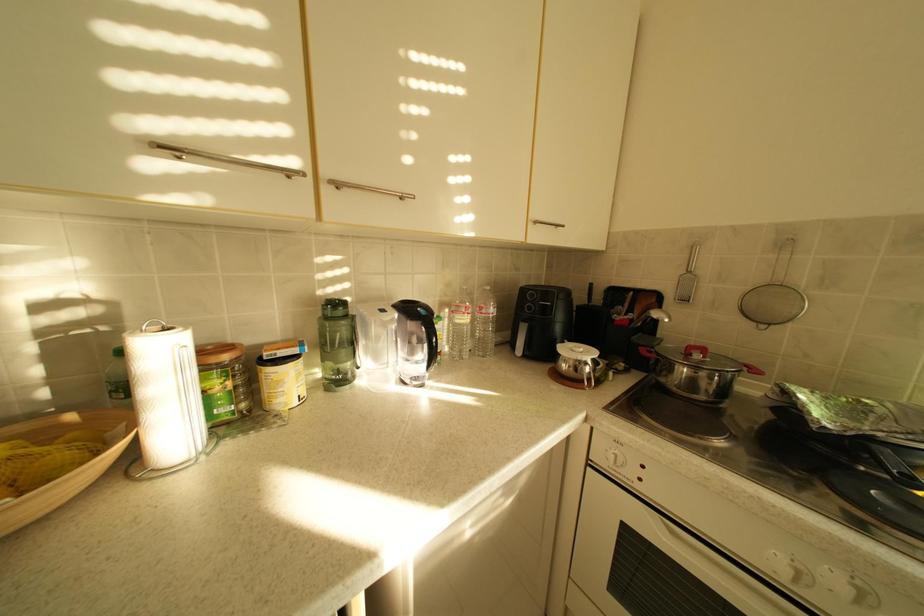
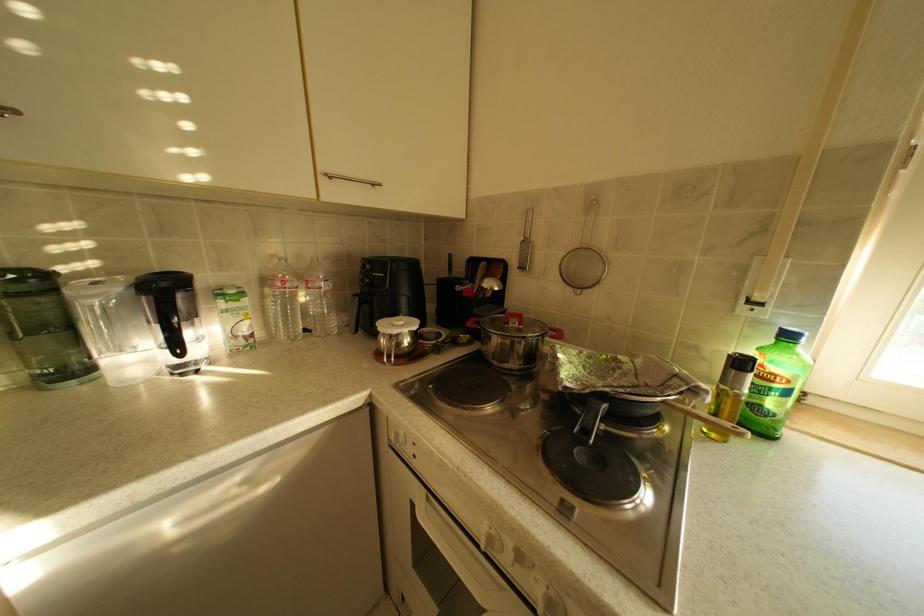
Question: What movement of the cameraman would produce the second image?

Choices:
 (A) Left
 (B) Right
 (C) Forward
 (D) Backward

Answer: (B)